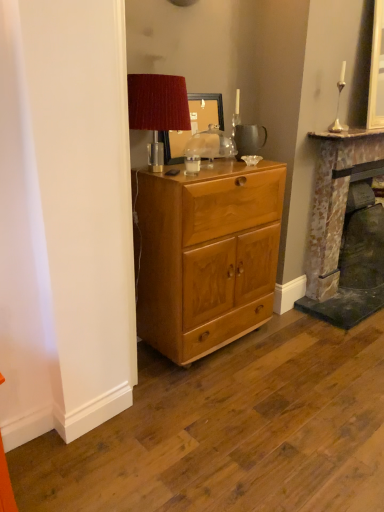
Question: Does wooden picture frame at center have a greater width compared to rustic stone fireplace at right?

Choices:
 (A) yes
 (B) no

Answer: (B)

Question: Does wooden picture frame at center turn towards rustic stone fireplace at right?

Choices:
 (A) no
 (B) yes

Answer: (A)

Question: Is rustic stone fireplace at right a part of wooden picture frame at center?

Choices:
 (A) yes
 (B) no

Answer: (B)

Question: Does wooden picture frame at center have a larger size compared to rustic stone fireplace at right?

Choices:
 (A) yes
 (B) no

Answer: (B)

Question: Is wooden picture frame at center in contact with rustic stone fireplace at right?

Choices:
 (A) yes
 (B) no

Answer: (B)

Question: Is the position of wooden picture frame at center less distant than that of rustic stone fireplace at right?

Choices:
 (A) no
 (B) yes

Answer: (B)

Question: Does velvet red lampshade at upper center turn towards rustic stone fireplace at right?

Choices:
 (A) yes
 (B) no

Answer: (B)

Question: From a real-world perspective, is velvet red lampshade at upper center located beneath rustic stone fireplace at right?

Choices:
 (A) yes
 (B) no

Answer: (B)

Question: Can you confirm if velvet red lampshade at upper center is bigger than rustic stone fireplace at right?

Choices:
 (A) no
 (B) yes

Answer: (A)

Question: Is velvet red lampshade at upper center touching rustic stone fireplace at right?

Choices:
 (A) no
 (B) yes

Answer: (A)

Question: Is rustic stone fireplace at right completely or partially inside velvet red lampshade at upper center?

Choices:
 (A) no
 (B) yes

Answer: (A)

Question: Is velvet red lampshade at upper center shorter than rustic stone fireplace at right?

Choices:
 (A) no
 (B) yes

Answer: (B)

Question: Can you confirm if light brown wood cabinet at center is bigger than rustic stone fireplace at right?

Choices:
 (A) no
 (B) yes

Answer: (A)